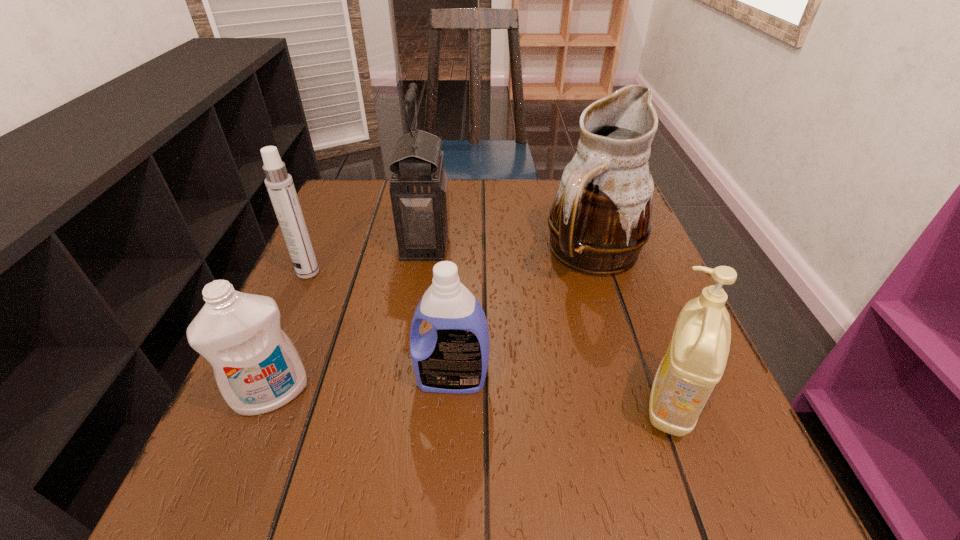
This screenshot has height=540, width=960. Identify the location of blank area in the image that satisfies the following two spatial constraints: 1. on the back side of the second detergent from left to right; 2. on the front-facing side of the lantern. (460, 243).